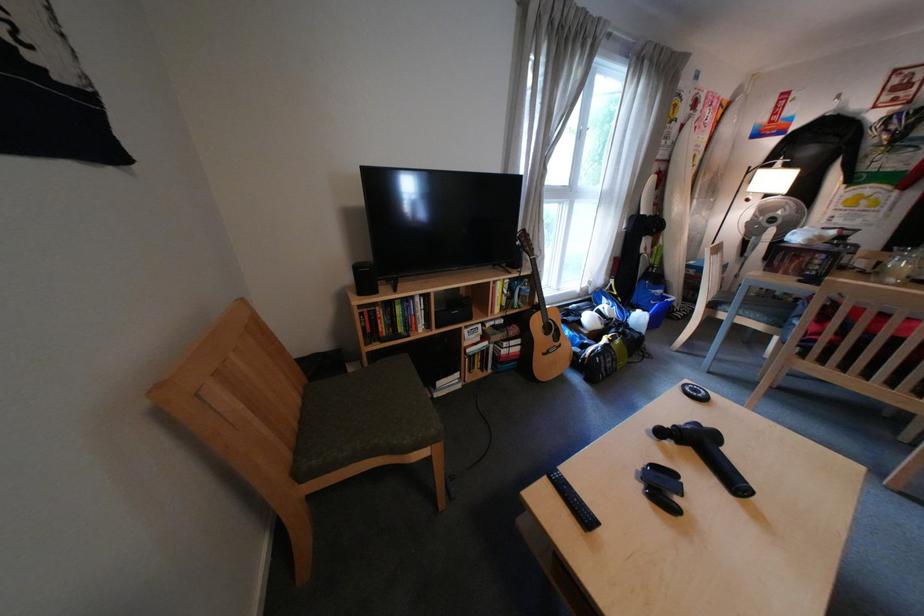
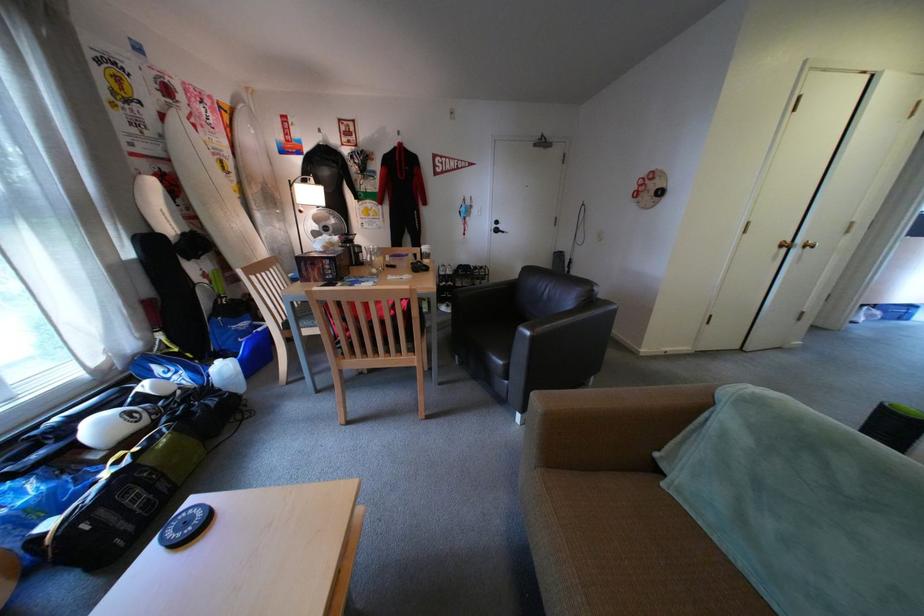
Locate, in the second image, the point that corresponds to (865,254) in the first image.

(373, 253)